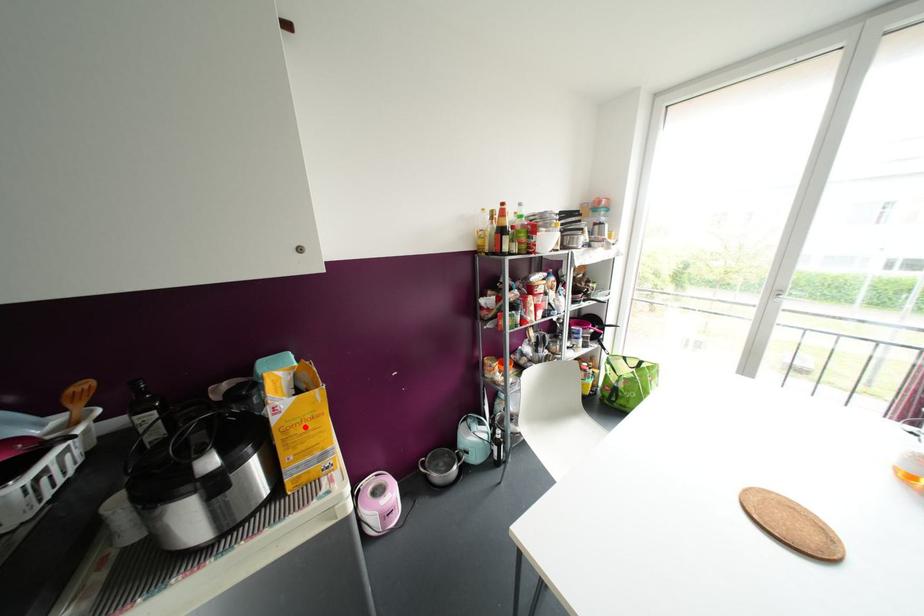
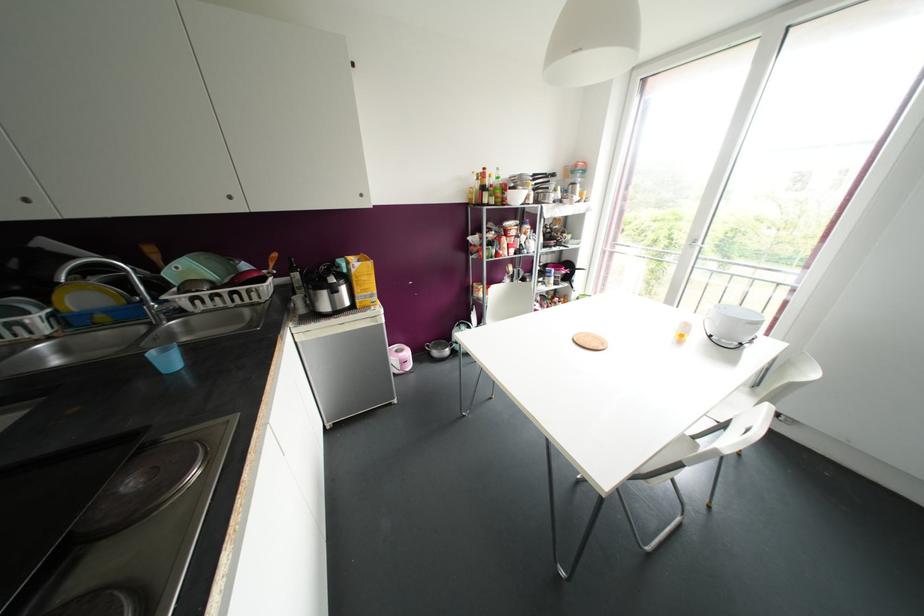
Question: I am providing you with two images of the same scene from different viewpoints. A red point is shown in image1. For the corresponding object point in image2, is it positioned nearer or farther from the camera?

Choices:
 (A) Nearer
 (B) Farther

Answer: (A)